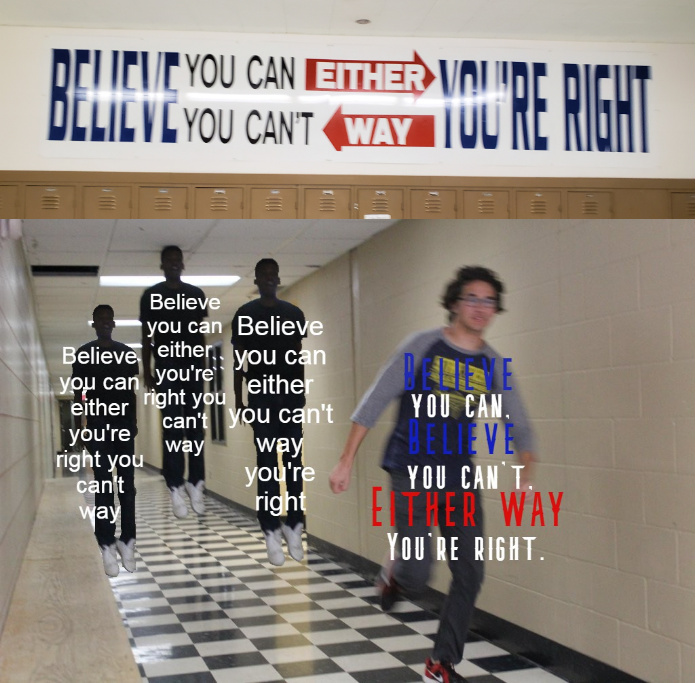
In order to click on lockers in this screenshot , I will do `click(179, 191)`.